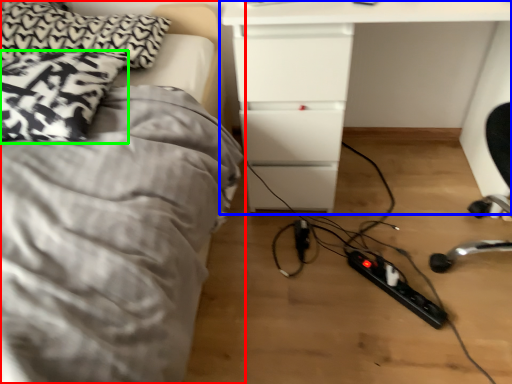
Question: Estimate the real-world distances between objects in this image. Which object is closer to bed (highlighted by a red box), table (highlighted by a blue box) or pillow (highlighted by a green box)?

Choices:
 (A) table
 (B) pillow

Answer: (B)